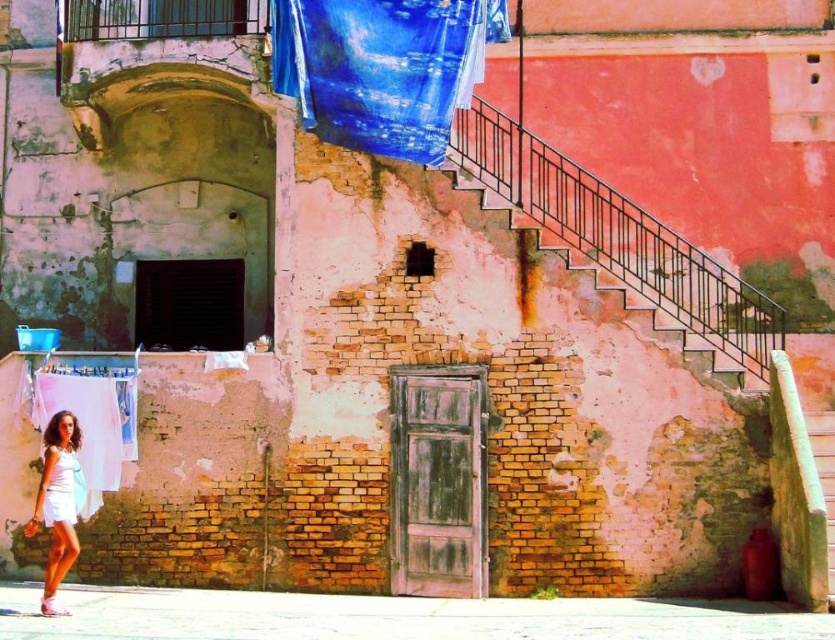
Question: Which object is closer to the camera taking this photo?

Choices:
 (A) white matte dress at lower left
 (B) rusty metal stairs at center
 (C) white matte skirt at lower left
 (D) white fabric at lower left

Answer: (C)

Question: Which object is closer to the camera taking this photo?

Choices:
 (A) white fabric at lower left
 (B) white matte skirt at lower left
 (C) white matte dress at lower left
 (D) smooth concrete stairs at center

Answer: (B)

Question: In this image, where is blue fabric at upper center located relative to white matte dress at lower left?

Choices:
 (A) above
 (B) below

Answer: (A)

Question: Is white fabric at lower left below white matte dress at lower left?

Choices:
 (A) no
 (B) yes

Answer: (A)

Question: From the image, what is the correct spatial relationship of white matte skirt at lower left in relation to smooth concrete stairs at center?

Choices:
 (A) below
 (B) above

Answer: (A)

Question: Which point is farther from the camera taking this photo?

Choices:
 (A) pos(821,477)
 (B) pos(68,515)
 (C) pos(735,307)

Answer: (C)